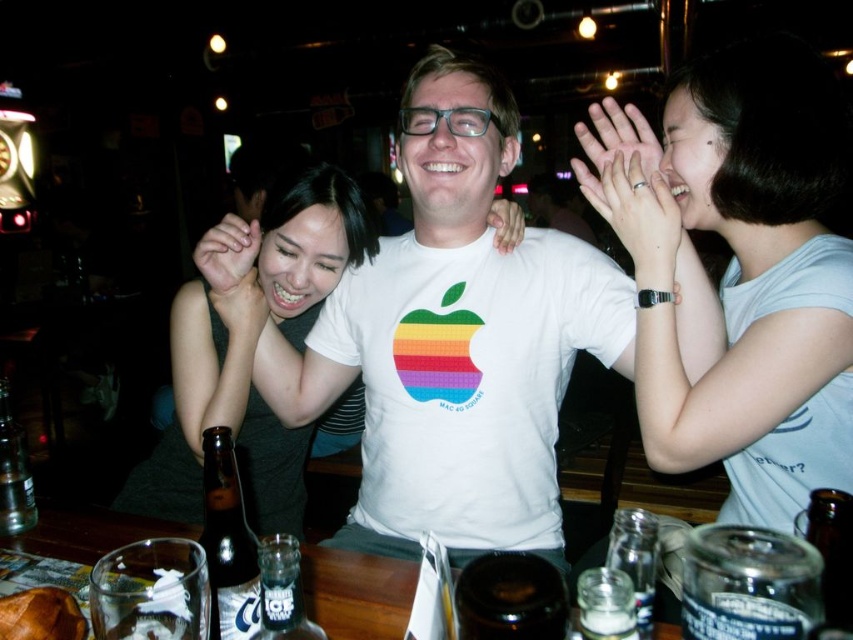
At what (x,y) coordinates should I click in order to perform the action: click on matte black hand at upper left. Please return your answer as a coordinate pair (x, y). The width and height of the screenshot is (853, 640). Looking at the image, I should click on (227, 252).

Is matte black hand at upper left above matte skin hand at center?

Correct, matte black hand at upper left is located above matte skin hand at center.

Image resolution: width=853 pixels, height=640 pixels. What do you see at coordinates (227, 252) in the screenshot?
I see `matte black hand at upper left` at bounding box center [227, 252].

Image resolution: width=853 pixels, height=640 pixels. What are the coordinates of `matte black hand at upper left` in the screenshot? It's located at (227, 252).

Does matte silver ring at upper center appear on the right side of matte black hand at upper left?

Yes, matte silver ring at upper center is to the right of matte black hand at upper left.

Is matte silver ring at upper center closer to the viewer compared to matte black hand at upper left?

Yes, matte silver ring at upper center is in front of matte black hand at upper left.

Is point (605, 113) more distant than point (247, 272)?

Yes.

The width and height of the screenshot is (853, 640). Identify the location of matte silver ring at upper center. (619, 136).

Locate an element on the screen. The height and width of the screenshot is (640, 853). white matte t-shirt at center is located at coordinates (456, 340).

Does white matte t-shirt at center have a lesser width compared to matte black hand at upper left?

No, white matte t-shirt at center is not thinner than matte black hand at upper left.

Is point (334, 374) positioned after point (221, 257)?

That is True.

Identify the location of white matte t-shirt at center. Image resolution: width=853 pixels, height=640 pixels. (456, 340).